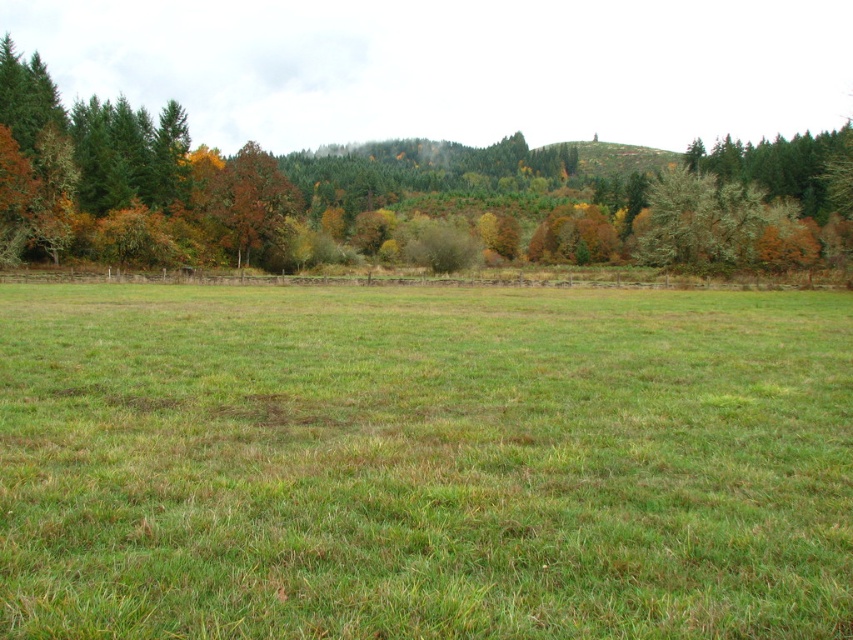
Question: Which object is the closest to the orange-brown bark tree at upper left?

Choices:
 (A) green leafy tree at center
 (B) green grass pasture at center

Answer: (B)

Question: Does green leafy tree at center have a greater width compared to orange-brown bark tree at upper left?

Choices:
 (A) no
 (B) yes

Answer: (B)

Question: Can you confirm if green grass pasture at center is thinner than green leafy tree at center?

Choices:
 (A) yes
 (B) no

Answer: (A)

Question: Does green leafy tree at center have a greater width compared to orange-brown bark tree at upper left?

Choices:
 (A) yes
 (B) no

Answer: (A)

Question: Which of these objects is positioned closest to the orange-brown bark tree at upper left?

Choices:
 (A) green leafy tree at center
 (B) green grass pasture at center

Answer: (B)

Question: Which of the following is the farthest from the observer?

Choices:
 (A) green grass pasture at center
 (B) orange-brown bark tree at upper left

Answer: (B)